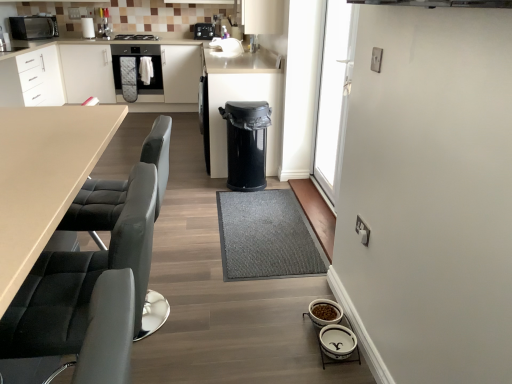
Find the location of a particular element. The image size is (512, 384). free space that is in between transparent glass door at upper right and black leather swivel chair at left is located at coordinates (248, 239).